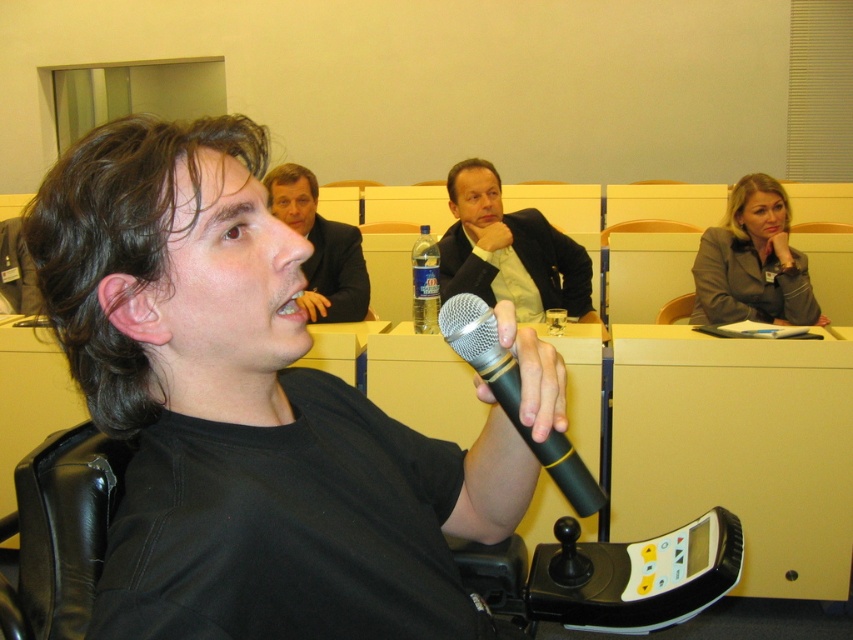
Is point (491, 227) closer to camera compared to point (277, 196)?

No, it is not.

How much distance is there between light brown suit at center and light brown suit at upper center?

light brown suit at center is 17.68 inches from light brown suit at upper center.

Locate an element on the screen. This screenshot has width=853, height=640. light brown suit at center is located at coordinates (508, 250).

Does light brown suit at center appear on the right side of matte gray blazer at upper right?

In fact, light brown suit at center is to the left of matte gray blazer at upper right.

Is point (566, 284) positioned after point (769, 285)?

No, it is in front of (769, 285).

Who is more forward, (439,244) or (776,273)?

Point (439,244)

At what (x,y) coordinates should I click in order to perform the action: click on light brown suit at center. Please return your answer as a coordinate pair (x, y). This screenshot has height=640, width=853. Looking at the image, I should click on (508, 250).

Measure the distance from matte gray blazer at upper right to light brown suit at upper center.

A distance of 1.32 meters exists between matte gray blazer at upper right and light brown suit at upper center.

The height and width of the screenshot is (640, 853). I want to click on matte gray blazer at upper right, so click(753, 262).

The width and height of the screenshot is (853, 640). What are the coordinates of `matte gray blazer at upper right` in the screenshot? It's located at (753, 262).